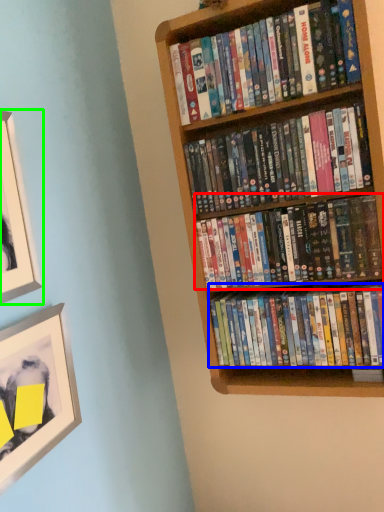
Question: Which object is positioned closest to book (highlighted by a red box)? Select from book (highlighted by a blue box) and picture frame (highlighted by a green box).

Choices:
 (A) book
 (B) picture frame

Answer: (A)